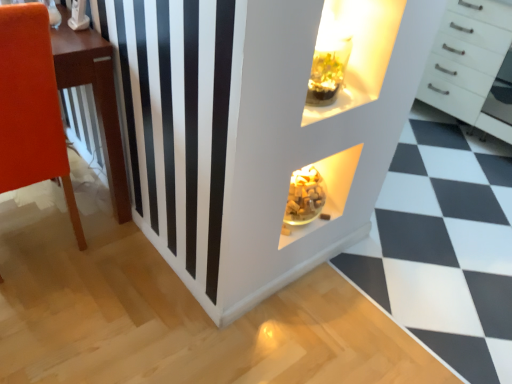
Question: From a real-world perspective, does matte orange chair at left sit lower than white glossy dresser at center?

Choices:
 (A) yes
 (B) no

Answer: (B)

Question: Is matte orange chair at left to the right of white glossy dresser at center from the viewer's perspective?

Choices:
 (A) yes
 (B) no

Answer: (B)

Question: Does matte orange chair at left have a greater width compared to white glossy dresser at center?

Choices:
 (A) no
 (B) yes

Answer: (A)

Question: Could you tell me if matte orange chair at left is facing white glossy dresser at center?

Choices:
 (A) yes
 (B) no

Answer: (B)

Question: Does matte orange chair at left appear on the left side of white glossy dresser at center?

Choices:
 (A) yes
 (B) no

Answer: (A)

Question: Considering the positions of point (256, 215) and point (488, 3), is point (256, 215) closer or farther from the camera than point (488, 3)?

Choices:
 (A) farther
 (B) closer

Answer: (B)

Question: Considering the positions of white glossy dresser at center and white glossy chest of drawers at upper right in the image, is white glossy dresser at center wider or thinner than white glossy chest of drawers at upper right?

Choices:
 (A) wide
 (B) thin

Answer: (A)

Question: From a real-world perspective, is white glossy dresser at center physically located above or below white glossy chest of drawers at upper right?

Choices:
 (A) above
 (B) below

Answer: (B)

Question: From their relative heights in the image, would you say white glossy dresser at center is taller or shorter than white glossy chest of drawers at upper right?

Choices:
 (A) short
 (B) tall

Answer: (A)

Question: Would you say white glossy chest of drawers at upper right is to the left or to the right of matte orange chair at left in the picture?

Choices:
 (A) left
 (B) right

Answer: (B)

Question: Does point (501, 34) appear closer or farther from the camera than point (12, 79)?

Choices:
 (A) closer
 (B) farther

Answer: (B)

Question: From a real-world perspective, relative to matte orange chair at left, is white glossy chest of drawers at upper right vertically above or below?

Choices:
 (A) above
 (B) below

Answer: (B)

Question: Considering the positions of white glossy chest of drawers at upper right and matte orange chair at left in the image, is white glossy chest of drawers at upper right taller or shorter than matte orange chair at left?

Choices:
 (A) short
 (B) tall

Answer: (A)

Question: Is white glossy dresser at center inside or outside of matte orange chair at left?

Choices:
 (A) outside
 (B) inside

Answer: (A)

Question: Considering the positions of white glossy dresser at center and matte orange chair at left in the image, is white glossy dresser at center wider or thinner than matte orange chair at left?

Choices:
 (A) wide
 (B) thin

Answer: (A)